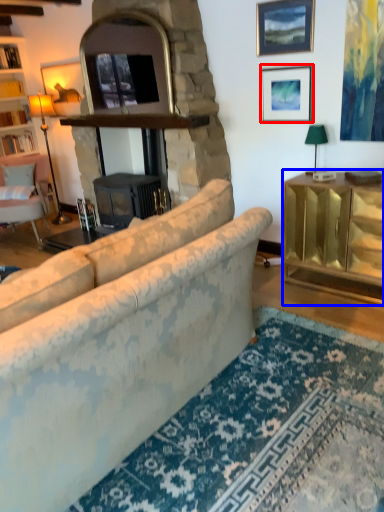
Question: Among these objects, which one is nearest to the camera, picture frame (highlighted by a red box) or cabinetry (highlighted by a blue box)?

Choices:
 (A) picture frame
 (B) cabinetry

Answer: (B)